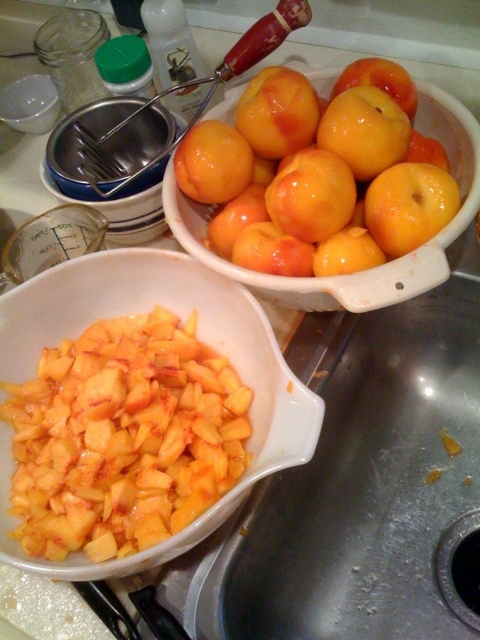
You are a chef preparing a fruit salad and need to know which container has more height. You have the yellow matte diced peaches at center and the transparent plastic bowl at upper left. Which one is taller?

The yellow matte diced peaches at center is taller than the transparent plastic bowl at upper left according to the description.

You are a chef preparing a fruit salad and need to place the yellow matte peaches at upper center and the orange matte apple at center into a mixing bowl. The mixing bowl has a diameter of 6 inches. Can both fruits fit side by side in the bowl without overlapping?

The distance between the yellow matte peaches at upper center and orange matte apple at center is 5.30 inches. Since the mixing bowl has a diameter of 6 inches, which is larger than the distance between them, both fruits can fit side by side in the bowl without overlapping.

You are a chef preparing a fruit salad and need to place a spoon exactly at the point marked by coordinates point (199, 337). According to the scene, where should you place the spoon?

The point (199, 337) is on the yellow matte diced peaches at center, so you should place the spoon there.